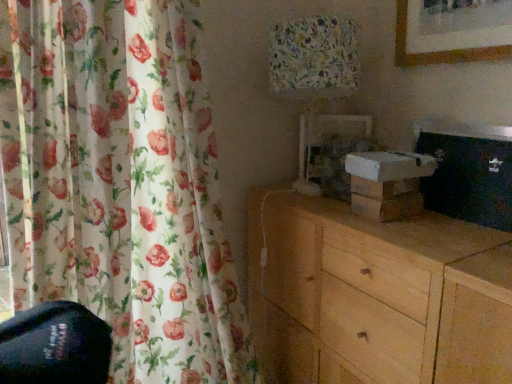
Question: Is floral fabric lampshade at upper center shorter than floral fabric curtain at left?

Choices:
 (A) no
 (B) yes

Answer: (B)

Question: Is floral fabric curtain at left at the back of floral fabric lampshade at upper center?

Choices:
 (A) yes
 (B) no

Answer: (B)

Question: Considering the relative positions of floral fabric lampshade at upper center and floral fabric curtain at left in the image provided, is floral fabric lampshade at upper center behind floral fabric curtain at left?

Choices:
 (A) yes
 (B) no

Answer: (A)

Question: From a real-world perspective, is floral fabric lampshade at upper center physically above floral fabric curtain at left?

Choices:
 (A) no
 (B) yes

Answer: (B)

Question: Can you confirm if floral fabric lampshade at upper center is taller than floral fabric curtain at left?

Choices:
 (A) no
 (B) yes

Answer: (A)

Question: Looking at their shapes, would you say floral fabric curtain at left is wider or thinner than light wood chest of drawers at lower right?

Choices:
 (A) thin
 (B) wide

Answer: (A)

Question: Is floral fabric curtain at left inside or outside of light wood chest of drawers at lower right?

Choices:
 (A) outside
 (B) inside

Answer: (A)

Question: From a real-world perspective, is floral fabric curtain at left above or below light wood chest of drawers at lower right?

Choices:
 (A) above
 (B) below

Answer: (A)

Question: Considering the positions of floral fabric curtain at left and light wood chest of drawers at lower right in the image, is floral fabric curtain at left taller or shorter than light wood chest of drawers at lower right?

Choices:
 (A) tall
 (B) short

Answer: (A)

Question: Does point (355, 87) appear closer or farther from the camera than point (367, 296)?

Choices:
 (A) farther
 (B) closer

Answer: (A)

Question: From the image's perspective, is floral fabric lampshade at upper center above or below light wood chest of drawers at lower right?

Choices:
 (A) above
 (B) below

Answer: (A)

Question: Do you think floral fabric lampshade at upper center is within light wood chest of drawers at lower right, or outside of it?

Choices:
 (A) outside
 (B) inside

Answer: (A)

Question: In terms of height, does floral fabric lampshade at upper center look taller or shorter compared to light wood chest of drawers at lower right?

Choices:
 (A) tall
 (B) short

Answer: (B)

Question: Considering the positions of light wood chest of drawers at lower right and floral fabric curtain at left in the image, is light wood chest of drawers at lower right taller or shorter than floral fabric curtain at left?

Choices:
 (A) tall
 (B) short

Answer: (B)

Question: Considering the positions of light wood chest of drawers at lower right and floral fabric curtain at left in the image, is light wood chest of drawers at lower right wider or thinner than floral fabric curtain at left?

Choices:
 (A) wide
 (B) thin

Answer: (A)